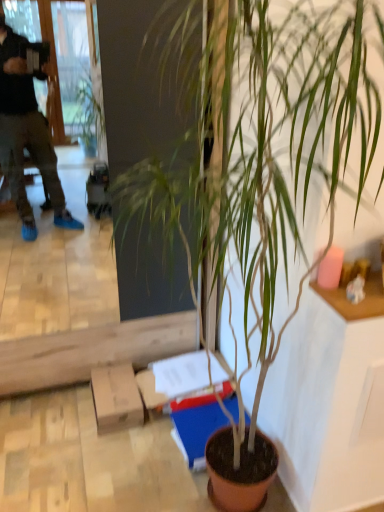
Question: Should I look upward or downward to see brown cardboard box at lower center?

Choices:
 (A) up
 (B) down

Answer: (B)